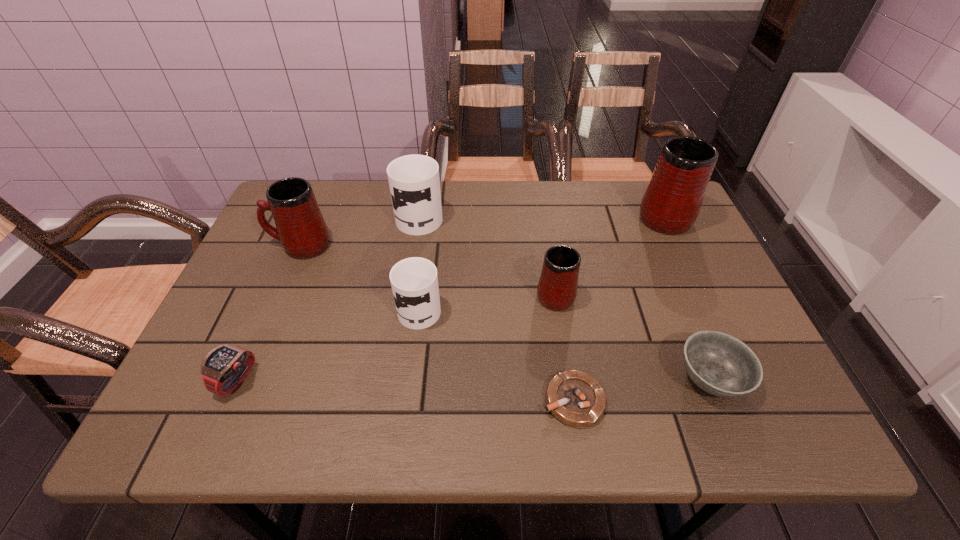
Find the location of a particular element. free space between the bigger white mug and the nearest red mug is located at coordinates (488, 254).

The width and height of the screenshot is (960, 540). I want to click on empty location between the farther white mug and the leftmost mug, so click(360, 230).

Find the location of a particular element. vacant region between the rightmost red mug and the ashtray is located at coordinates (618, 307).

Find the location of `free space between the ashtray and the smaller white mug`. free space between the ashtray and the smaller white mug is located at coordinates (496, 353).

The height and width of the screenshot is (540, 960). I want to click on vacant space that's between the smallest red mug and the ashtray, so click(x=564, y=347).

This screenshot has height=540, width=960. Identify the location of free point between the second mug from right to left and the watch. (396, 336).

Identify the location of vacant space in between the watch and the shortest object. This screenshot has height=540, width=960. coord(406,390).

Where is `the third closest object to the farther white mug`? The height and width of the screenshot is (540, 960). the third closest object to the farther white mug is located at coordinates 557,288.

Identify the location of the fourth closest object to the bigger white mug. pyautogui.click(x=224, y=368).

I want to click on mug that is the fourth closest to the bowl, so click(x=414, y=182).